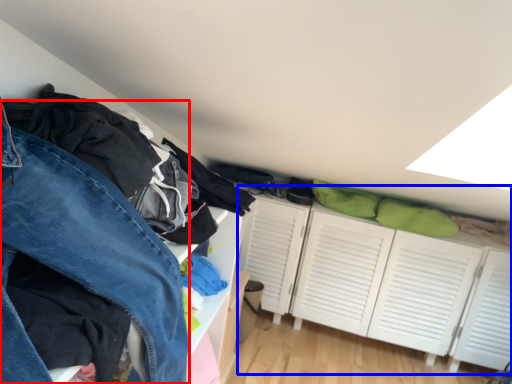
Question: Which object appears farthest to the camera in this image, trousers (highlighted by a red box) or dresser (highlighted by a blue box)?

Choices:
 (A) trousers
 (B) dresser

Answer: (B)